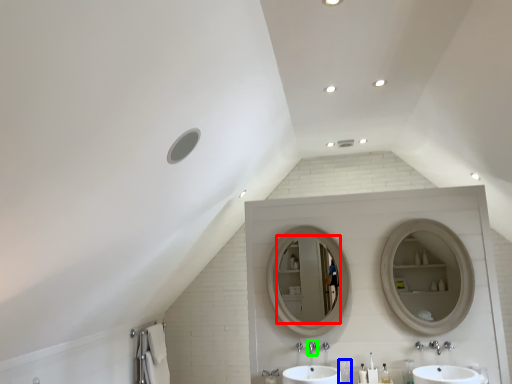
Question: Which object is the farthest from mirror (highlighted by a red box)? Choose among these: toiletry (highlighted by a blue box) or plumbing fixture (highlighted by a green box).

Choices:
 (A) toiletry
 (B) plumbing fixture

Answer: (A)